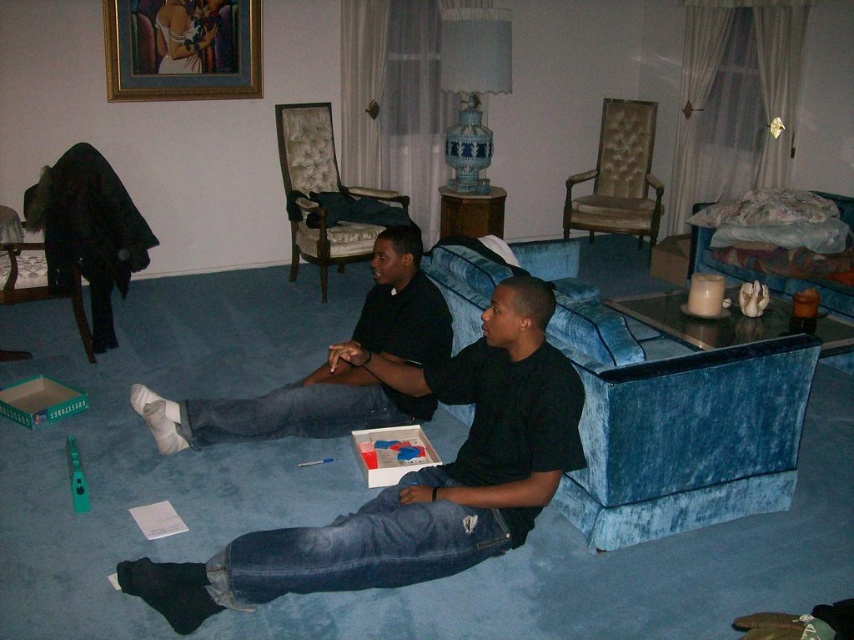
Question: Is matte black shirt at center smaller than velvet blue couch at right?

Choices:
 (A) yes
 (B) no

Answer: (A)

Question: Which of these objects is positioned farthest from the matte black shirt at center?

Choices:
 (A) velvet blue couch at lower center
 (B) velvet armchair at left
 (C) beige tufted fabric armchair at upper center
 (D) white matte socks at lower left

Answer: (C)

Question: Does velvet blue couch at lower center appear on the right side of gold-framed artwork at upper left?

Choices:
 (A) no
 (B) yes

Answer: (B)

Question: Which of these objects is positioned farthest from the beige tufted fabric armchair at upper center?

Choices:
 (A) velvet upholstered armchair at center
 (B) velvet blue couch at lower center

Answer: (B)

Question: Among these objects, which one is nearest to the camera?

Choices:
 (A) velvet upholstered armchair at center
 (B) velvet blue couch at lower center
 (C) gold-framed artwork at upper left

Answer: (B)

Question: Is velvet blue couch at lower center above beige tufted fabric armchair at upper center?

Choices:
 (A) no
 (B) yes

Answer: (A)